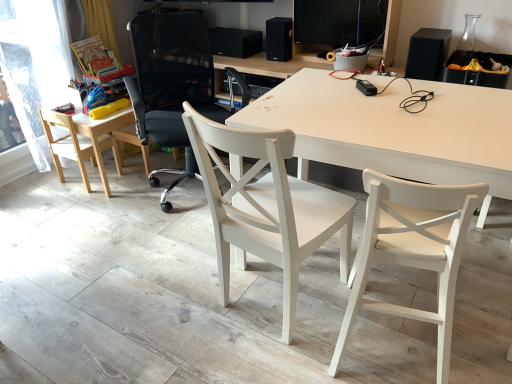
At what (x,y) coordinates should I click in order to perform the action: click on vacant area in front of light wood chair at left, arranged as the 1th chair when viewed from the left. Please return your answer as a coordinate pair (x, y). This screenshot has width=512, height=384. Looking at the image, I should click on (78, 194).